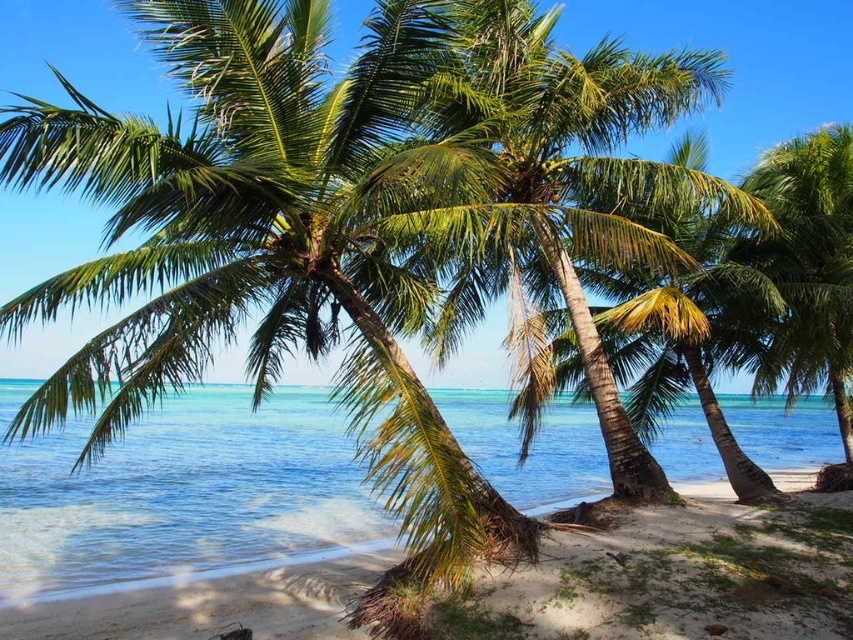
Question: Does clear blue water at center appear under green leafy palm tree at right?

Choices:
 (A) yes
 (B) no

Answer: (A)

Question: Which point is closer to the camera taking this photo?

Choices:
 (A) (289, 557)
 (B) (799, 166)

Answer: (A)

Question: Can you confirm if clear blue water at center is positioned to the right of green leafy palm tree at right?

Choices:
 (A) no
 (B) yes

Answer: (A)

Question: Which of the following is the closest to the observer?

Choices:
 (A) (126, 477)
 (B) (805, 152)

Answer: (B)

Question: Does clear blue water at center have a greater width compared to green leafy palm tree at right?

Choices:
 (A) no
 (B) yes

Answer: (B)

Question: Which of the following is the farthest from the observer?

Choices:
 (A) (843, 291)
 (B) (221, 428)

Answer: (B)